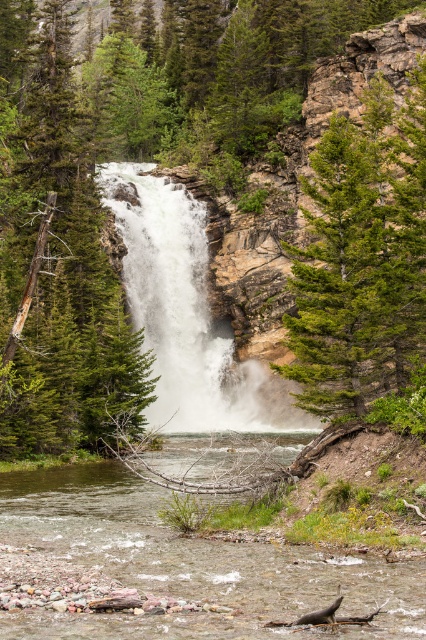
Is brown gravel river at lower center to the right of white frothy water at center from the viewer's perspective?

Correct, you'll find brown gravel river at lower center to the right of white frothy water at center.

Where is `brown gravel river at lower center`? Image resolution: width=426 pixels, height=640 pixels. brown gravel river at lower center is located at coordinates (184, 566).

Measure the distance between point (210, 612) and camera.

A distance of 16.14 meters exists between point (210, 612) and camera.

Locate an element on the screen. The width and height of the screenshot is (426, 640). brown gravel river at lower center is located at coordinates (184, 566).

How far apart are brown gravel river at lower center and green rough bark tree at upper center?

brown gravel river at lower center and green rough bark tree at upper center are 34.19 feet apart from each other.

Between brown gravel river at lower center and green rough bark tree at upper center, which one appears on the left side from the viewer's perspective?

Positioned to the left is brown gravel river at lower center.

Find the location of a particular element. brown gravel river at lower center is located at coordinates (184, 566).

The width and height of the screenshot is (426, 640). Identify the location of brown gravel river at lower center. (184, 566).

Which is in front, point (34, 317) or point (178, 422)?

Point (34, 317) is in front.

Which of these two, green matte tree at left or white frothy water at center, stands shorter?

white frothy water at center is shorter.

The height and width of the screenshot is (640, 426). I want to click on green matte tree at left, so click(57, 257).